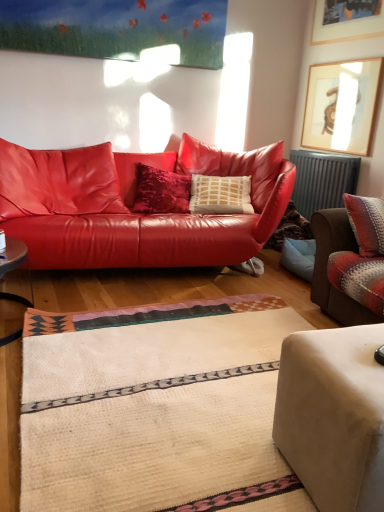
Question: Considering the relative sizes of matte leather couch at center, which ranks as the first studio couch in back-to-front order, and beige fabric ottoman at lower right, acting as the 3th studio couch starting from the back, in the image provided, is matte leather couch at center, which ranks as the first studio couch in back-to-front order, taller than beige fabric ottoman at lower right, acting as the 3th studio couch starting from the back,?

Choices:
 (A) yes
 (B) no

Answer: (A)

Question: Is matte leather couch at center, acting as the 3th studio couch starting from the front, positioned in front of beige fabric ottoman at lower right, acting as the 3th studio couch starting from the back?

Choices:
 (A) yes
 (B) no

Answer: (B)

Question: From a real-world perspective, is matte leather couch at center, which ranks as the first studio couch in back-to-front order, over beige fabric ottoman at lower right, acting as the 3th studio couch starting from the back?

Choices:
 (A) no
 (B) yes

Answer: (B)

Question: From the image's perspective, is matte leather couch at center, which ranks as the first studio couch in back-to-front order, located above beige fabric ottoman at lower right, acting as the 3th studio couch starting from the back?

Choices:
 (A) yes
 (B) no

Answer: (A)

Question: From the image's perspective, is matte leather couch at center, which ranks as the first studio couch in back-to-front order, below beige fabric ottoman at lower right, the first studio couch when ordered from front to back?

Choices:
 (A) yes
 (B) no

Answer: (B)

Question: From a real-world perspective, relative to wooden picture frame at upper right, the 1th picture frame from the top, is metallic gray radiator at right vertically above or below?

Choices:
 (A) below
 (B) above

Answer: (A)

Question: Considering the positions of metallic gray radiator at right and wooden picture frame at upper right, the 1th picture frame from the top, in the image, is metallic gray radiator at right wider or thinner than wooden picture frame at upper right, the 1th picture frame from the top,?

Choices:
 (A) thin
 (B) wide

Answer: (B)

Question: Is metallic gray radiator at right spatially inside wooden picture frame at upper right, positioned as the second picture frame in bottom-to-top order, or outside of it?

Choices:
 (A) inside
 (B) outside

Answer: (B)

Question: Is point pyautogui.click(x=314, y=163) closer or farther from the camera than point pyautogui.click(x=349, y=4)?

Choices:
 (A) closer
 (B) farther

Answer: (B)

Question: From a real-world perspective, is matte leather couch at center, acting as the 3th studio couch starting from the front, above or below wooden picture frame at upper right, the 1th picture frame from the top?

Choices:
 (A) above
 (B) below

Answer: (B)

Question: Based on their positions, is matte leather couch at center, which ranks as the first studio couch in back-to-front order, located to the left or right of wooden picture frame at upper right, the 1th picture frame from the top?

Choices:
 (A) right
 (B) left

Answer: (B)

Question: Is matte leather couch at center, acting as the 3th studio couch starting from the front, in front of or behind wooden picture frame at upper right, the 1th picture frame from the top, in the image?

Choices:
 (A) behind
 (B) front

Answer: (B)

Question: Considering the positions of point (46, 173) and point (334, 17), is point (46, 173) closer or farther from the camera than point (334, 17)?

Choices:
 (A) closer
 (B) farther

Answer: (A)

Question: Based on their positions, is wooden framed artwork at upper right, the first picture frame when ordered from bottom to top, located to the left or right of velvet brown armchair at right, the second studio couch from the front?

Choices:
 (A) right
 (B) left

Answer: (A)

Question: From their relative heights in the image, would you say wooden framed artwork at upper right, which is counted as the second picture frame, starting from the top, is taller or shorter than velvet brown armchair at right, the second studio couch from the front?

Choices:
 (A) tall
 (B) short

Answer: (A)